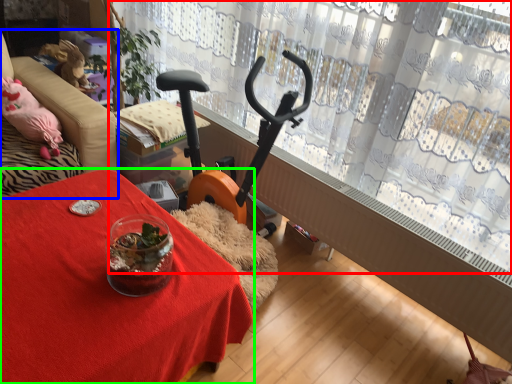
Question: Based on their relative distances, which object is nearer to curtain (highlighted by a red box)? Choose from furniture (highlighted by a blue box) and table (highlighted by a green box).

Choices:
 (A) furniture
 (B) table

Answer: (A)